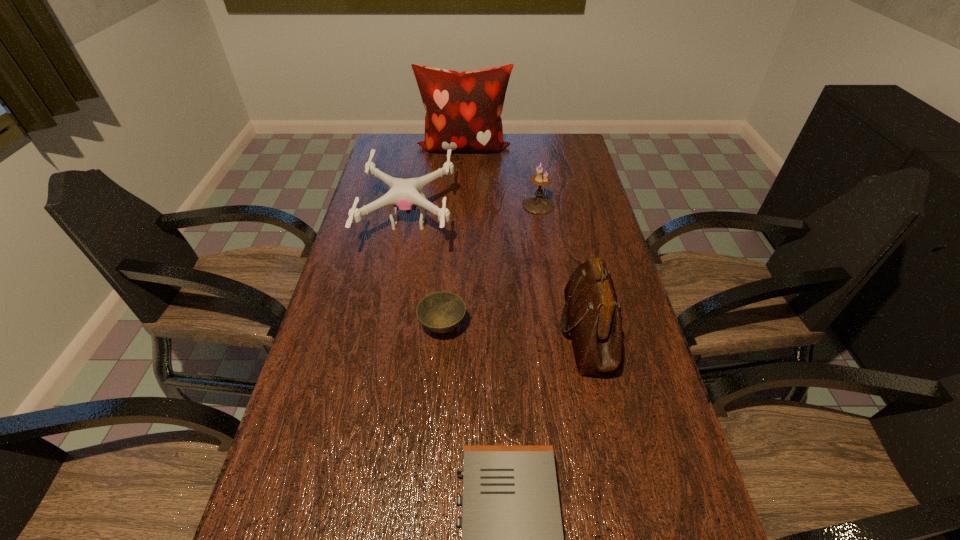
Image resolution: width=960 pixels, height=540 pixels. In order to click on free space in the image that satisfies the following two spatial constraints: 1. on the top of the bowl; 2. on the left side of the drone in this screenshot , I will do `click(390, 327)`.